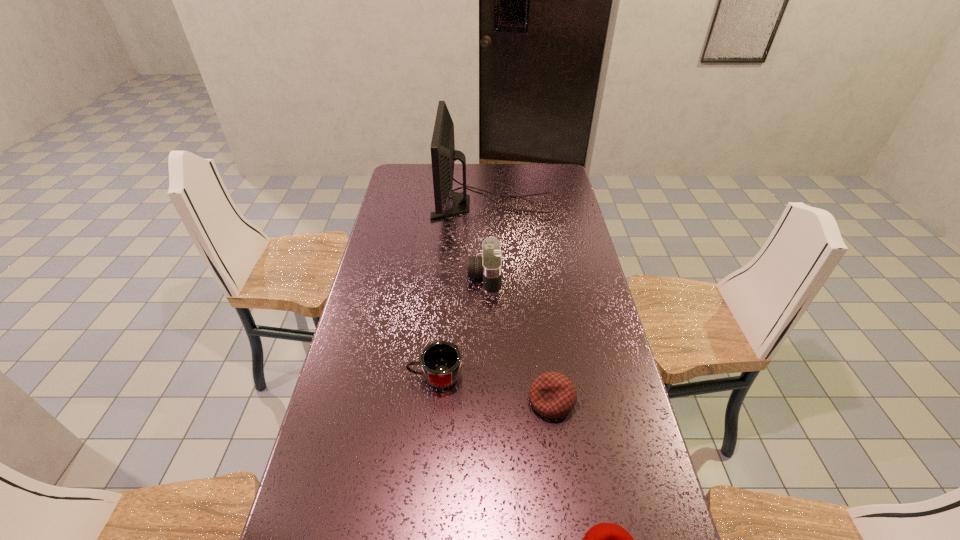
Locate an element on the screen. object that is the second nearest to the third shortest object is located at coordinates (489, 266).

Identify the location of free space that satisfies the following two spatial constraints: 1. on the front-facing side of the camera; 2. on the left side of the farther beanbag. This screenshot has height=540, width=960. (486, 401).

The height and width of the screenshot is (540, 960). I want to click on vacant area in the image that satisfies the following two spatial constraints: 1. on the front-facing side of the fourth nearest object; 2. on the back side of the farther beanbag, so click(486, 401).

You are a GUI agent. You are given a task and a screenshot of the screen. Output one action in this format:
    pyautogui.click(x=<x>, y=<y>)
    Task: Click on the vacant space that satisfies the following two spatial constraints: 1. on the screen side of the farther beanbag; 2. on the left side of the tallest object
    
    Given the screenshot: What is the action you would take?
    pyautogui.click(x=499, y=401)